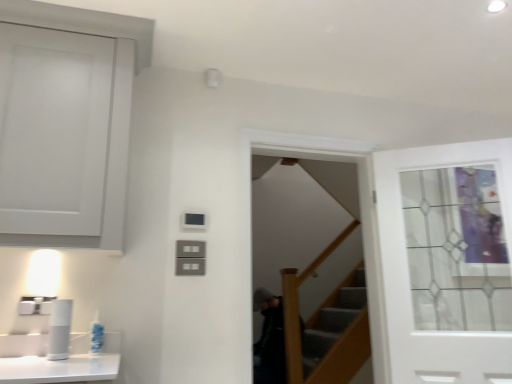
Question: Is white plastic toothbrush at lower left aimed at white glass door at upper right?

Choices:
 (A) yes
 (B) no

Answer: (B)

Question: Does white plastic toothbrush at lower left have a greater height compared to white glass door at upper right?

Choices:
 (A) no
 (B) yes

Answer: (A)

Question: From a real-world perspective, is white plastic toothbrush at lower left over white glass door at upper right?

Choices:
 (A) yes
 (B) no

Answer: (B)

Question: Is white plastic toothbrush at lower left thinner than white glass door at upper right?

Choices:
 (A) no
 (B) yes

Answer: (B)

Question: Can you confirm if white plastic toothbrush at lower left is wider than white glass door at upper right?

Choices:
 (A) yes
 (B) no

Answer: (B)

Question: Is there a large distance between white plastic toothbrush at lower left and white glass door at upper right?

Choices:
 (A) no
 (B) yes

Answer: (B)

Question: From a real-world perspective, is white glass door at upper right below white plastic toothbrush at lower left?

Choices:
 (A) yes
 (B) no

Answer: (B)

Question: Could white plastic toothbrush at lower left be considered to be inside white glass door at upper right?

Choices:
 (A) yes
 (B) no

Answer: (B)

Question: From a real-world perspective, is white glass door at upper right on top of white plastic toothbrush at lower left?

Choices:
 (A) yes
 (B) no

Answer: (A)

Question: From the image's perspective, is white glass door at upper right located above white plastic toothbrush at lower left?

Choices:
 (A) no
 (B) yes

Answer: (B)

Question: Does white glass door at upper right turn towards white plastic toothbrush at lower left?

Choices:
 (A) no
 (B) yes

Answer: (A)

Question: Does white glass door at upper right have a greater height compared to white plastic toothbrush at lower left?

Choices:
 (A) yes
 (B) no

Answer: (A)

Question: Is clear glass screen door at center beside white plastic toothbrush at lower left?

Choices:
 (A) yes
 (B) no

Answer: (B)